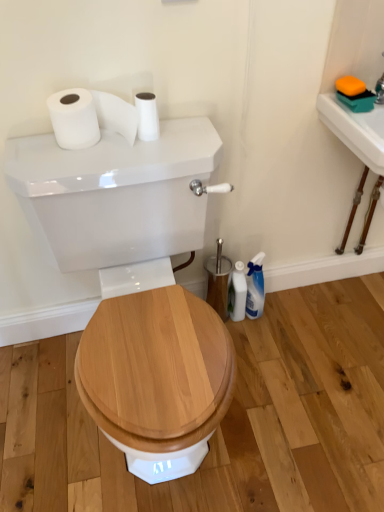
Identify the location of vacant area that lies to the right of white glossy toilet tank at center. This screenshot has width=384, height=512. pos(304,385).